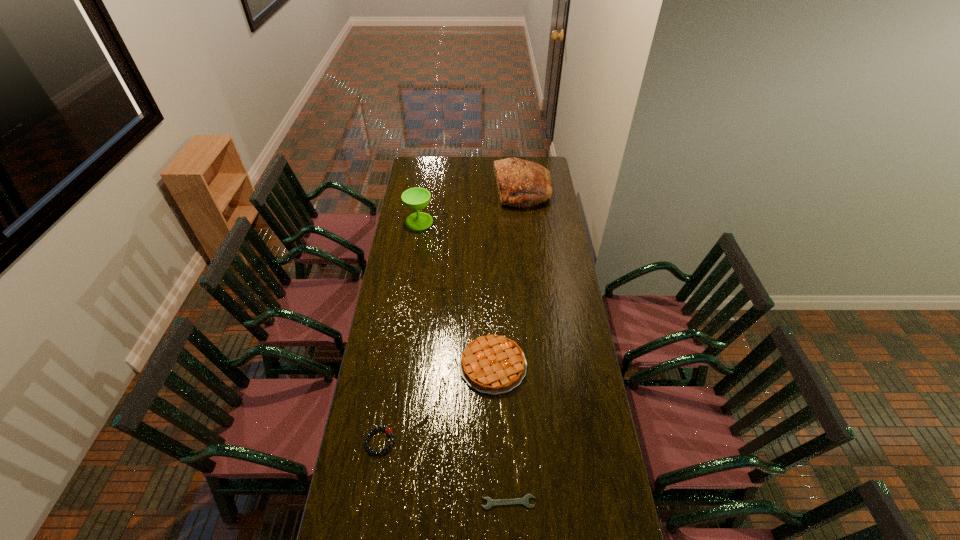
The height and width of the screenshot is (540, 960). Identify the location of free location located at the sliced front of the farthest object. (427, 191).

Locate an element on the screen. The image size is (960, 540). vacant region located 0.190m on the front of the second farthest object is located at coordinates point(414,254).

Locate an element on the screen. This screenshot has height=540, width=960. blank area located 0.200m on the left of the pie is located at coordinates (411, 366).

Identify the location of vacant space located on the back of the bracelet. (396, 348).

I want to click on vacant space located on the right of the nearest object, so click(617, 502).

The width and height of the screenshot is (960, 540). What are the coordinates of `object present at the far edge` in the screenshot? It's located at (521, 183).

Find the location of a particular element. This screenshot has height=540, width=960. wineglass that is at the left edge is located at coordinates (417, 198).

The height and width of the screenshot is (540, 960). What are the coordinates of `bracelet present at the left edge` in the screenshot? It's located at (388, 430).

The width and height of the screenshot is (960, 540). What are the coordinates of `object present at the right edge` in the screenshot? It's located at (521, 183).

You are a GUI agent. You are given a task and a screenshot of the screen. Output one action in this format:
    pyautogui.click(x=<x>, y=<y>)
    Task: Click on the object that is at the far right corner
    
    Given the screenshot: What is the action you would take?
    pyautogui.click(x=521, y=183)